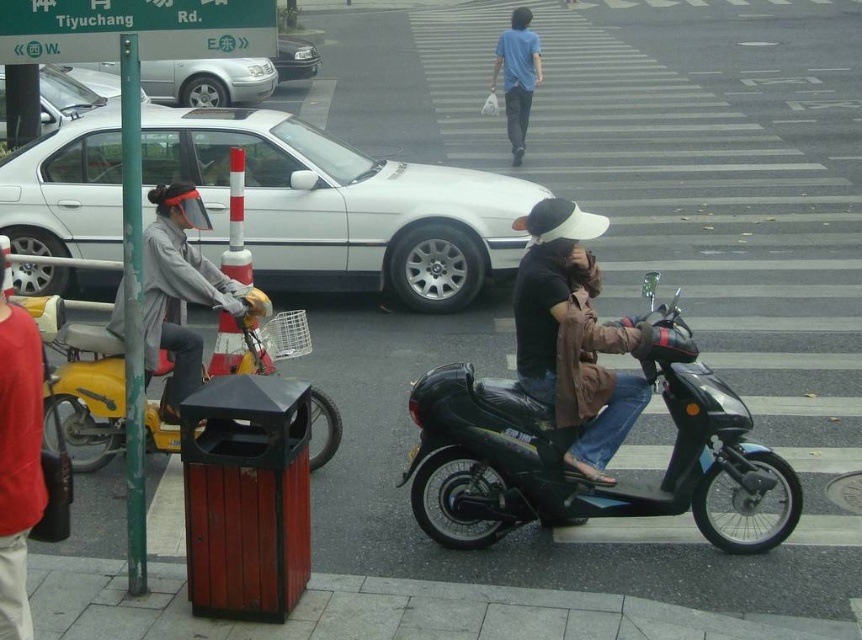
Which is more to the left, brown leather jacket at center or white glossy sedan at center?

white glossy sedan at center is more to the left.

Between point (642, 392) and point (117, 100), which one is positioned in front?

Point (642, 392) is more forward.

What do you see at coordinates (594, 372) in the screenshot?
I see `brown leather jacket at center` at bounding box center [594, 372].

Find the location of `brown leather jacket at center`. brown leather jacket at center is located at coordinates (594, 372).

Is yellow matte motorcycle at left taller than gray fabric jacket at left?

No, yellow matte motorcycle at left is not taller than gray fabric jacket at left.

Is yellow matte motorcycle at left bigger than gray fabric jacket at left?

Yes.

Is point (247, 355) positioned behind point (195, 301)?

That is True.

At what (x,y) coordinates should I click in order to perform the action: click on yellow matte motorcycle at left. Please return your answer as a coordinate pair (x, y). This screenshot has width=862, height=640. Looking at the image, I should click on (91, 392).

Is green plastic street sign at upper left below red sweater at left?

No, green plastic street sign at upper left is not below red sweater at left.

Is point (154, 29) positioned after point (0, 269)?

Yes, point (154, 29) is farther from viewer.

Locate an element on the screen. The width and height of the screenshot is (862, 640). green plastic street sign at upper left is located at coordinates (134, 28).